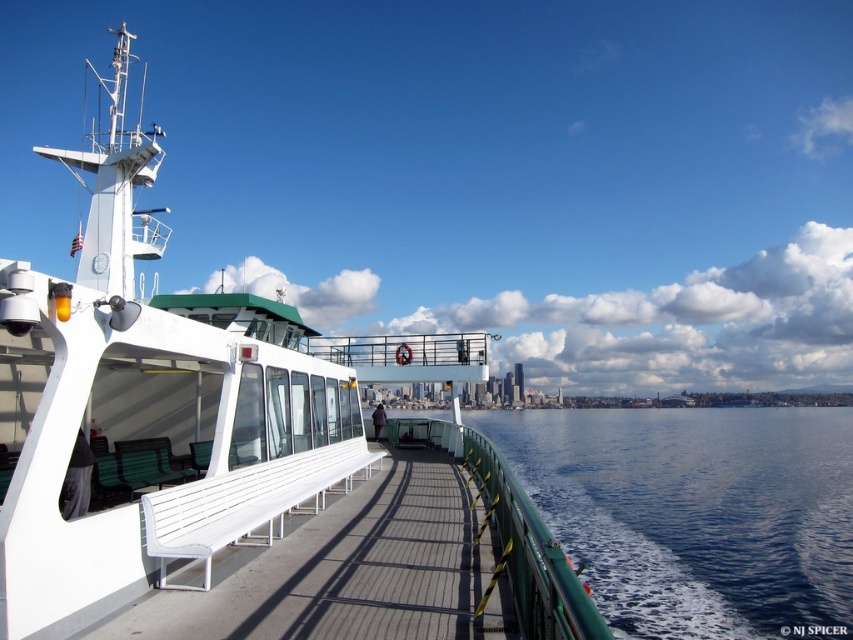
Question: Does white matte bench at center appear over blue water at center?

Choices:
 (A) no
 (B) yes

Answer: (B)

Question: Observing the image, what is the correct spatial positioning of white matte bench at center in reference to blue water at center?

Choices:
 (A) right
 (B) left

Answer: (B)

Question: Among these objects, which one is farthest from the camera?

Choices:
 (A) blue water at center
 (B) white matte bench at center

Answer: (A)

Question: Is white matte bench at center to the right of blue water at center from the viewer's perspective?

Choices:
 (A) yes
 (B) no

Answer: (B)

Question: Which object appears farthest from the camera in this image?

Choices:
 (A) white matte bench at center
 (B) blue water at center

Answer: (B)

Question: Which point appears closest to the camera in this image?

Choices:
 (A) (364, 340)
 (B) (747, 481)

Answer: (A)